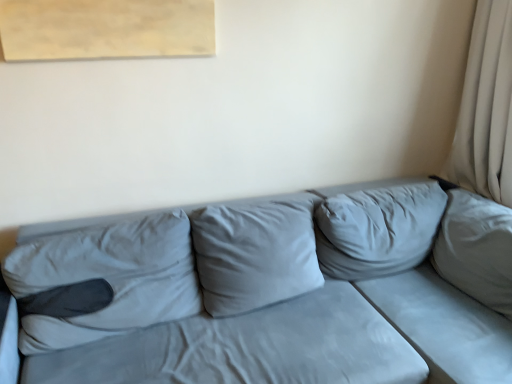
Question: Can you confirm if beige fabric curtain at right is thinner than suede gray couch at center?

Choices:
 (A) no
 (B) yes

Answer: (B)

Question: From the image's perspective, is beige fabric curtain at right beneath suede gray couch at center?

Choices:
 (A) yes
 (B) no

Answer: (B)

Question: Considering the relative positions of beige fabric curtain at right and suede gray couch at center in the image provided, is beige fabric curtain at right behind suede gray couch at center?

Choices:
 (A) yes
 (B) no

Answer: (A)

Question: Does beige fabric curtain at right have a larger size compared to suede gray couch at center?

Choices:
 (A) no
 (B) yes

Answer: (A)

Question: Considering the relative sizes of beige fabric curtain at right and suede gray couch at center in the image provided, is beige fabric curtain at right smaller than suede gray couch at center?

Choices:
 (A) yes
 (B) no

Answer: (A)

Question: Is beige fabric curtain at right to the left of suede gray couch at center from the viewer's perspective?

Choices:
 (A) yes
 (B) no

Answer: (B)

Question: Can you confirm if suede gray couch at center is shorter than beige fabric curtain at right?

Choices:
 (A) yes
 (B) no

Answer: (A)

Question: From a real-world perspective, is suede gray couch at center beneath beige fabric curtain at right?

Choices:
 (A) yes
 (B) no

Answer: (A)

Question: Is suede gray couch at center positioned behind beige fabric curtain at right?

Choices:
 (A) yes
 (B) no

Answer: (B)

Question: Considering the relative sizes of suede gray couch at center and beige fabric curtain at right in the image provided, is suede gray couch at center smaller than beige fabric curtain at right?

Choices:
 (A) no
 (B) yes

Answer: (A)

Question: Does suede gray couch at center have a lesser width compared to beige fabric curtain at right?

Choices:
 (A) yes
 (B) no

Answer: (B)

Question: Is suede gray couch at center in front of beige fabric curtain at right?

Choices:
 (A) yes
 (B) no

Answer: (A)

Question: Do you think suede gray couch at center is within beige fabric curtain at right, or outside of it?

Choices:
 (A) inside
 (B) outside

Answer: (B)